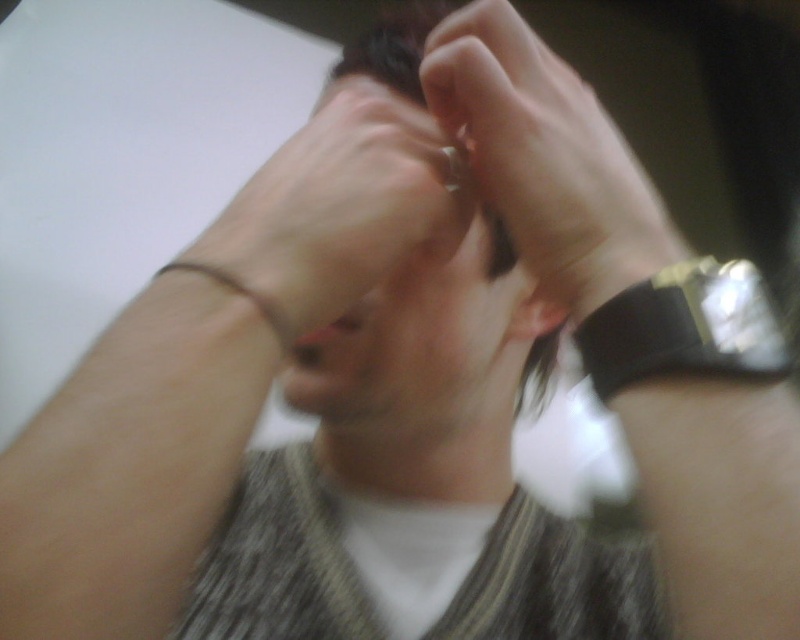
You are a photographer adjusting your camera settings to capture a close detail shot of a wrist accessory. You notice the black rubber wristband at right in the scene. Based on its distance from you, can you confirm if it will be in focus if your camera has a depth of field that can sharply capture objects within 10 inches?

The black rubber wristband at right is 9.89 inches away from the viewer, which is within the camera depth of field range of 10 inches. Therefore, it will be in focus.

You are a fashion designer observing a model wearing a black rubber wristband at right and a brown leather bracelet at left. Which accessory is taller when viewed from the front?

The black rubber wristband at right is much taller than the brown leather bracelet at left when viewed from the front.

You are a fashion designer observing a model wearing a white shirt and a striped garment. You notice the slightly translucent skin at center and the brown leather bracelet at left. Which object is located to the right of the other?

The slightly translucent skin at center is positioned on the right side of the brown leather bracelet at left.